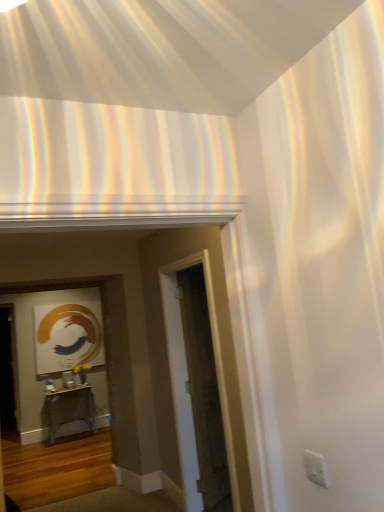
Question: In the image, is metallic silver table at center on the left side or the right side of transparent glass door at center?

Choices:
 (A) right
 (B) left

Answer: (B)

Question: From their relative heights in the image, would you say metallic silver table at center is taller or shorter than transparent glass door at center?

Choices:
 (A) tall
 (B) short

Answer: (B)

Question: Considering the positions of metallic silver table at center and transparent glass door at center in the image, is metallic silver table at center wider or thinner than transparent glass door at center?

Choices:
 (A) wide
 (B) thin

Answer: (A)

Question: Considering the positions of transparent glass door at center and metallic silver table at center in the image, is transparent glass door at center taller or shorter than metallic silver table at center?

Choices:
 (A) short
 (B) tall

Answer: (B)

Question: From the image's perspective, is transparent glass door at center located above or below metallic silver table at center?

Choices:
 (A) above
 (B) below

Answer: (A)

Question: Is transparent glass door at center situated inside metallic silver table at center or outside?

Choices:
 (A) outside
 (B) inside

Answer: (A)

Question: From a real-world perspective, relative to metallic silver table at center, is transparent glass door at center vertically above or below?

Choices:
 (A) above
 (B) below

Answer: (A)